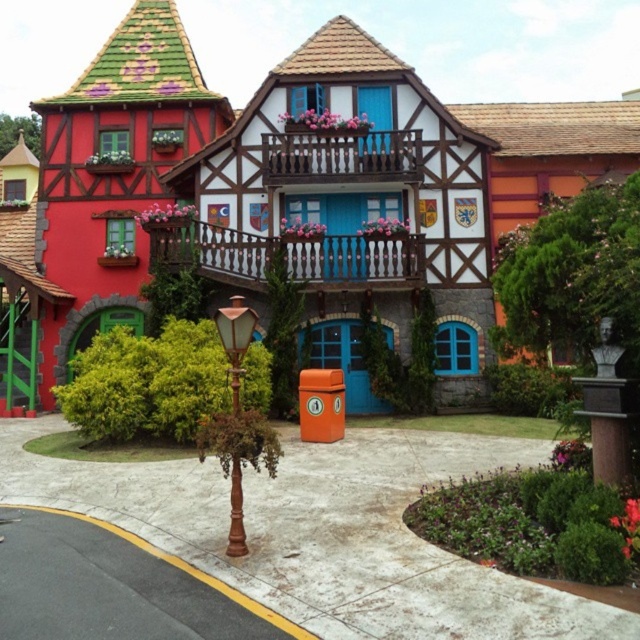
You are an architect analyzing the building structure. The wooden at upper center is a key structural element. Can you determine its location in terms of coordinates?

The wooden at upper center is located at coordinates point (x=340, y=156).

What is the 2D coordinate of the wooden balcony at center?

The wooden balcony at center is located at the 2D coordinate point of (288,253).

You are standing 50 feet away from the whimsical building. If you want to reach the point at coordinates point (365, 177), which is located on the building, can you reach it without moving closer?

The distance of point (365, 177) from viewer is 49.97 feet, so yes, you can reach it without moving closer since you are already at approximately the same distance.